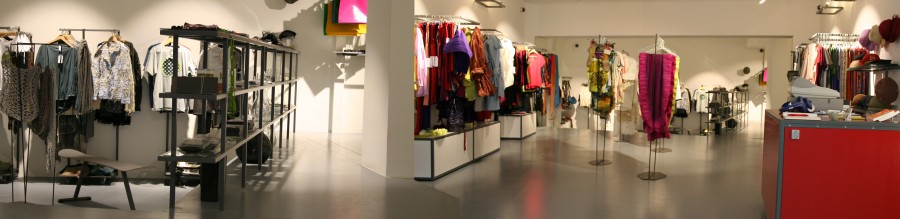
Where is `floor`? The width and height of the screenshot is (900, 219). floor is located at coordinates (338, 194).